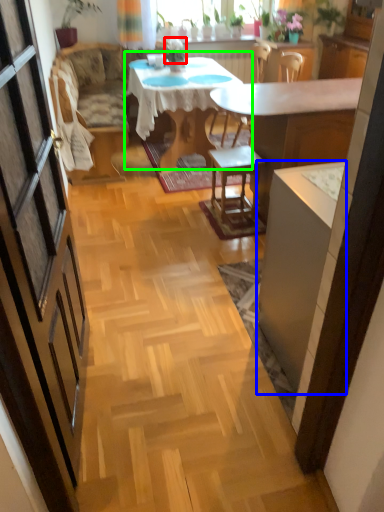
Question: Which object is the farthest from plant (highlighted by a red box)? Choose among these: cabinetry (highlighted by a blue box) or kitchen & dining room table (highlighted by a green box).

Choices:
 (A) cabinetry
 (B) kitchen & dining room table

Answer: (A)